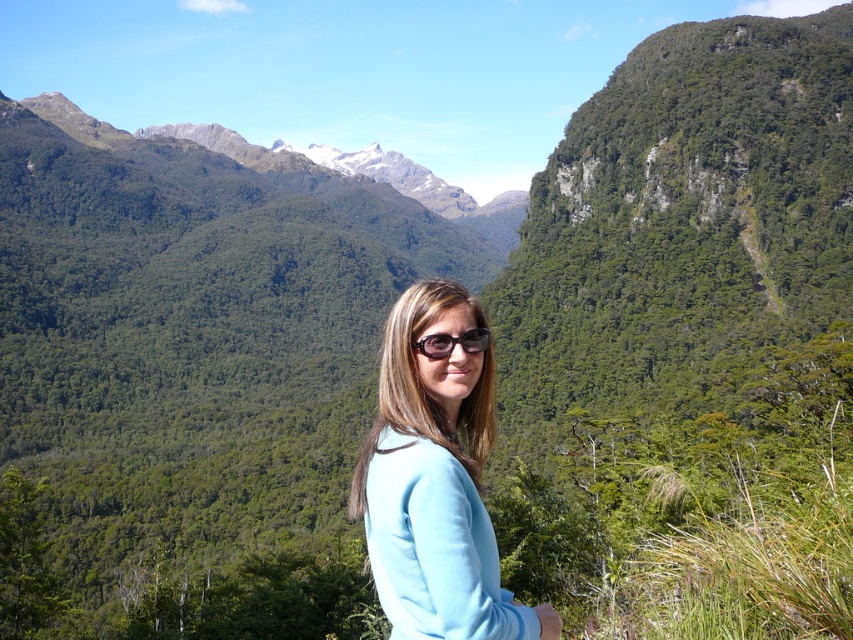
You are a photographer trying to capture a portrait of the person in the image. You want to ensure that both the light blue fabric at center and the black plastic sunglasses at center are in focus. Given that your camera has a depth of field that can cover 1.5 meters, will both objects be in focus?

The distance between the light blue fabric at center and black plastic sunglasses at center is 1.55 meters. Since the camera can only cover 1.5 meters, the objects will not both be in focus.

You are a photographer trying to capture the perfect shot of the person in the scene. You notice the light blue fabric at center and the black plastic sunglasses at center. Which object should you adjust your focus on first if you want to ensure both are in frame but prioritize the one closer to the camera?

The black plastic sunglasses at center should be focused on first because it is closer to the camera than the light blue fabric at center.